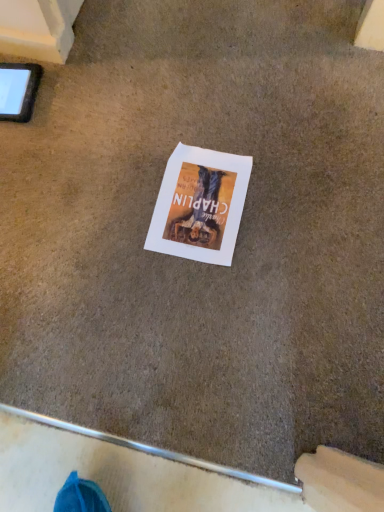
This screenshot has height=512, width=384. What do you see at coordinates (200, 205) in the screenshot?
I see `white paper at center` at bounding box center [200, 205].

I want to click on white paper at center, so click(x=200, y=205).

What do you see at coordinates (18, 90) in the screenshot?
I see `black matte tablet at upper left` at bounding box center [18, 90].

Measure the distance between black matte tablet at upper left and camera.

They are 3.60 feet apart.

The width and height of the screenshot is (384, 512). I want to click on black matte tablet at upper left, so click(x=18, y=90).

Find the location of `white paper at center`. white paper at center is located at coordinates tap(200, 205).

Which object is positioned more to the left, white paper at center or black matte tablet at upper left?

black matte tablet at upper left is more to the left.

From the picture: Does white paper at center lie in front of black matte tablet at upper left?

Yes, white paper at center is in front of black matte tablet at upper left.

Does point (211, 223) come farther from viewer compared to point (15, 77)?

No.

From the image's perspective, is white paper at center on top of black matte tablet at upper left?

No, from the image's perspective, white paper at center is not on top of black matte tablet at upper left.

From a real-world perspective, which is physically above, white paper at center or black matte tablet at upper left?

From a 3D spatial view, black matte tablet at upper left is above.

Can you confirm if white paper at center is wider than black matte tablet at upper left?

Yes, white paper at center is wider than black matte tablet at upper left.

Can you confirm if white paper at center is taller than black matte tablet at upper left?

No.

Is white paper at center bigger than black matte tablet at upper left?

No, white paper at center is not bigger than black matte tablet at upper left.

Is white paper at center located outside black matte tablet at upper left?

Indeed, white paper at center is completely outside black matte tablet at upper left.

Are white paper at center and black matte tablet at upper left making contact?

They are not placed beside each other.

Is white paper at center oriented towards black matte tablet at upper left?

No, white paper at center is not turned towards black matte tablet at upper left.

Where is `tablet computer on the left side of white paper at center`? The height and width of the screenshot is (512, 384). tablet computer on the left side of white paper at center is located at coordinates 18,90.

Between black matte tablet at upper left and white paper at center, which one appears on the right side from the viewer's perspective?

From the viewer's perspective, white paper at center appears more on the right side.

Is black matte tablet at upper left in front of white paper at center?

No, it is behind white paper at center.

Is point (39, 69) farther from camera compared to point (229, 221)?

Yes.

From the image's perspective, which one is positioned higher, black matte tablet at upper left or white paper at center?

black matte tablet at upper left.

From a real-world perspective, is black matte tablet at upper left below white paper at center?

No, from a real-world perspective, black matte tablet at upper left is not under white paper at center.

In terms of width, does black matte tablet at upper left look wider or thinner when compared to white paper at center?

black matte tablet at upper left is thinner than white paper at center.

Considering the sizes of objects black matte tablet at upper left and white paper at center in the image provided, who is shorter, black matte tablet at upper left or white paper at center?

white paper at center.

Considering the relative sizes of black matte tablet at upper left and white paper at center in the image provided, is black matte tablet at upper left smaller than white paper at center?

Actually, black matte tablet at upper left might be larger than white paper at center.

Would you say black matte tablet at upper left contains white paper at center?

No, white paper at center is not surrounded by black matte tablet at upper left.

Can you see black matte tablet at upper left touching white paper at center?

No, black matte tablet at upper left is not beside white paper at center.

Is black matte tablet at upper left aimed at white paper at center?

No, black matte tablet at upper left is not oriented towards white paper at center.

How different are the orientations of black matte tablet at upper left and white paper at center in degrees?

17.6 degrees separate the facing orientations of black matte tablet at upper left and white paper at center.

Locate an element on the screen. tablet computer above the white paper at center (from a real-world perspective) is located at coordinates (18, 90).

Image resolution: width=384 pixels, height=512 pixels. In order to click on flyer on the right of black matte tablet at upper left in this screenshot , I will do `click(200, 205)`.

I want to click on flyer lying in front of the black matte tablet at upper left, so click(200, 205).